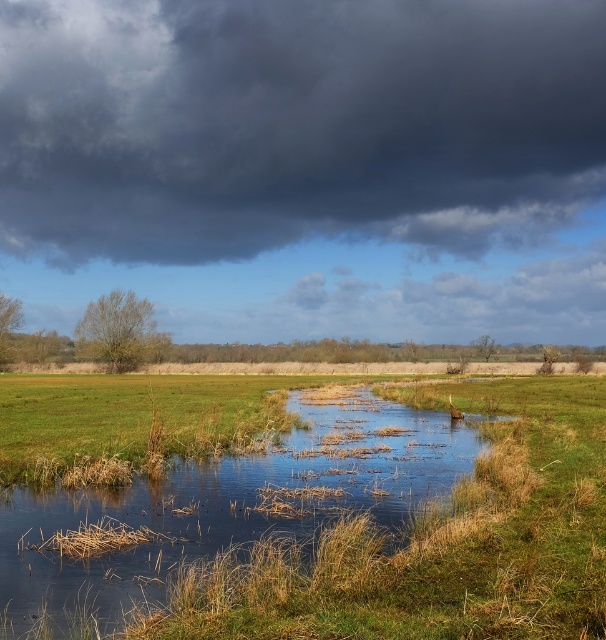
Is dark gray cloud at upper center above green grassy stream at center?

Yes, dark gray cloud at upper center is above green grassy stream at center.

Between dark gray cloud at upper center and green grassy stream at center, which one has more height?

With more height is dark gray cloud at upper center.

Describe the element at coordinates (295, 125) in the screenshot. Image resolution: width=606 pixels, height=640 pixels. I see `dark gray cloud at upper center` at that location.

Locate an element on the screen. The image size is (606, 640). dark gray cloud at upper center is located at coordinates (295, 125).